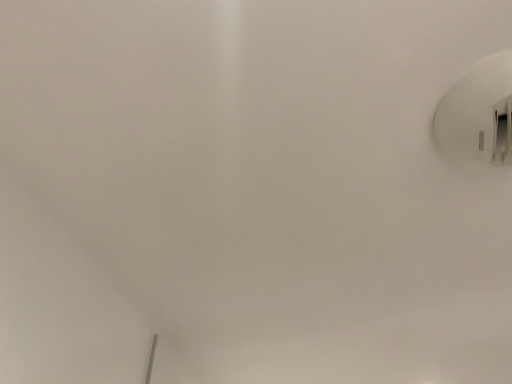
The height and width of the screenshot is (384, 512). I want to click on white plastic power plugs and sockets at upper right, so click(478, 113).

Image resolution: width=512 pixels, height=384 pixels. What do you see at coordinates (478, 113) in the screenshot?
I see `white plastic power plugs and sockets at upper right` at bounding box center [478, 113].

I want to click on white plastic power plugs and sockets at upper right, so click(x=478, y=113).